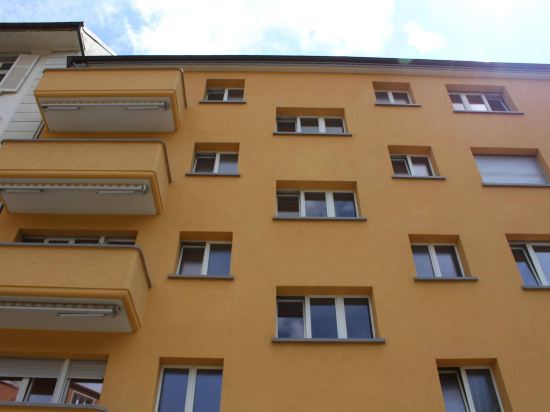
The image size is (550, 412). I want to click on rightmost window, so click(544, 264).